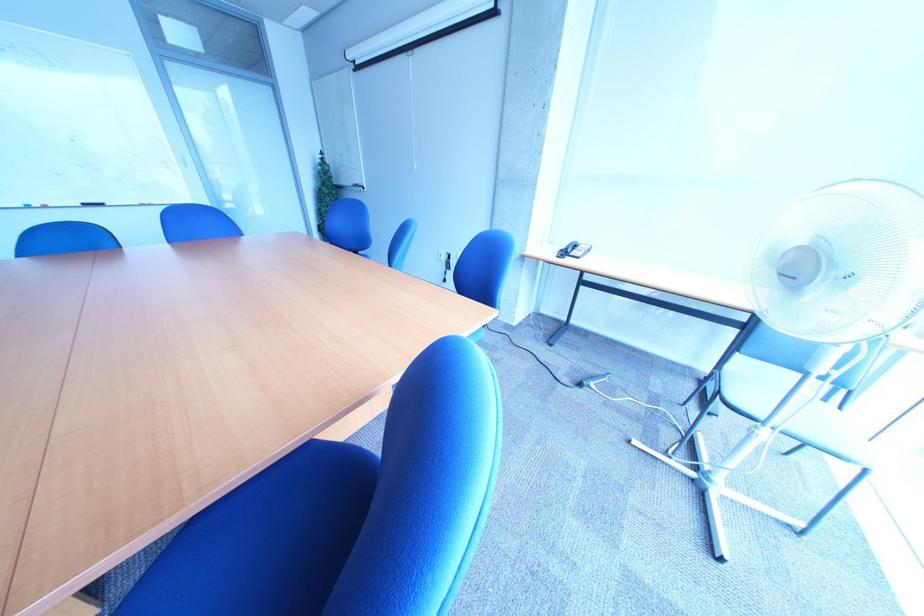
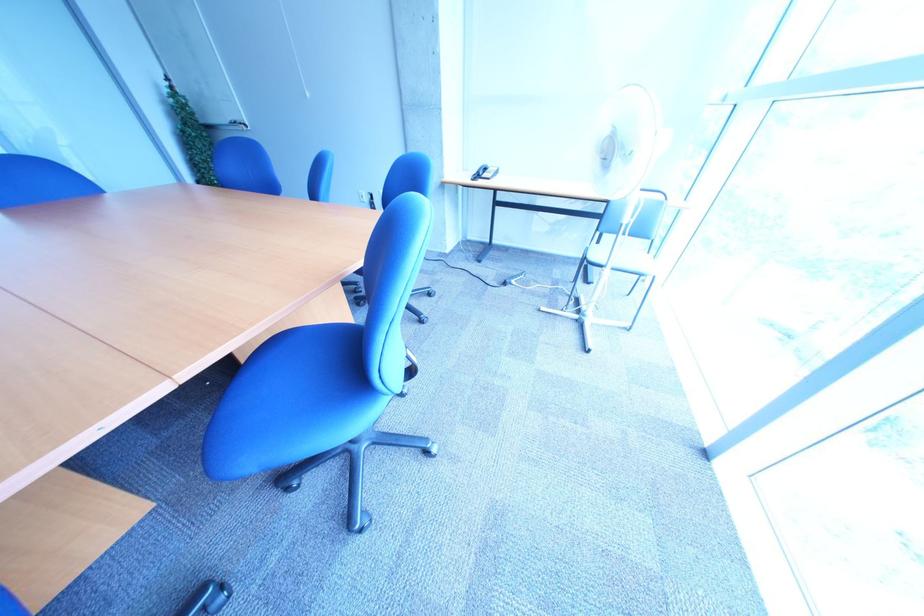
Question: How did the camera likely rotate?

Choices:
 (A) Left
 (B) Right
 (C) Up
 (D) Down

Answer: (B)